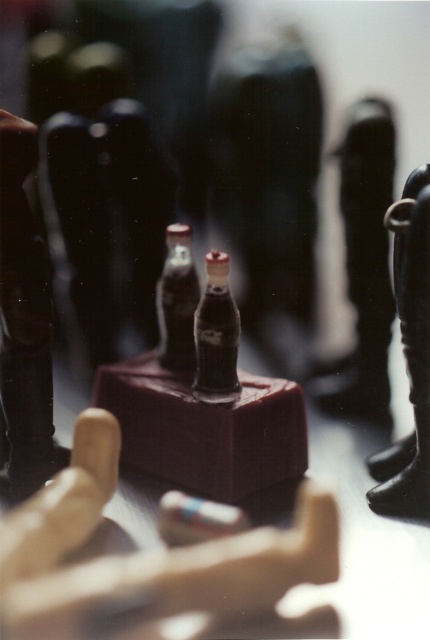
You are a small toy figure standing on the black rubber boot at right. You want to reach the matte glass bottle at center. Can you climb up the boot to reach the bottle?

The black rubber boot at right is positioned under the matte glass bottle at center, so yes, the toy figure can climb up the boot to reach the bottle.

You are a character in a miniature scene holding a small object. You need to place the black rubber boot at right and the matte glass bottle at center on a table. Which object should you place closer to the right edge of the table?

The black rubber boot at right should be placed closer to the right edge of the table because it is positioned on the right side of the matte glass bottle at center.

In the miniature scene, you see a shiny plastic bottles at center and a matte glass bottle at center. Which one is positioned to the right?

The shiny plastic bottles at center are positioned to the right of the matte glass bottle at center.